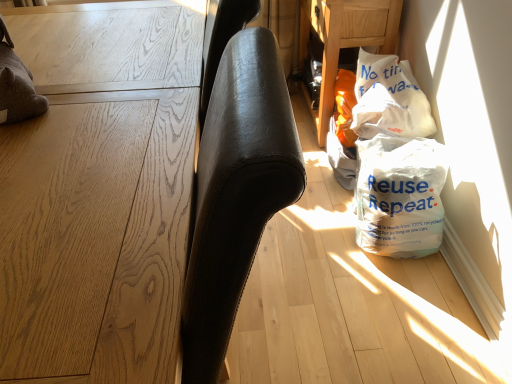
The height and width of the screenshot is (384, 512). Describe the element at coordinates (99, 193) in the screenshot. I see `light brown wood table at left` at that location.

What do you see at coordinates (400, 196) in the screenshot? Image resolution: width=512 pixels, height=384 pixels. I see `white plastic bag at lower right, positioned as the 1th grocery bag in bottom-to-top order` at bounding box center [400, 196].

Where is `white plastic bag at lower right`? The height and width of the screenshot is (384, 512). white plastic bag at lower right is located at coordinates (346, 39).

From a real-world perspective, who is located higher, white plastic bag at lower right or white plastic bag at upper right, which ranks as the 2th grocery bag in bottom-to-top order?

From a 3D spatial view, white plastic bag at upper right, which ranks as the 2th grocery bag in bottom-to-top order, is above.

Identify the location of table above the white plastic bag at upper right, which ranks as the 2th grocery bag in bottom-to-top order (from the image's perspective). (346, 39).

Would you consider white plastic bag at lower right to be distant from white plastic bag at upper right, which appears as the first grocery bag when viewed from the top?

That's not correct — white plastic bag at lower right is a little close to white plastic bag at upper right, which appears as the first grocery bag when viewed from the top.

Is white plastic bag at lower right not within white plastic bag at upper right, which ranks as the 2th grocery bag in bottom-to-top order?

Yes, white plastic bag at lower right is located beyond the bounds of white plastic bag at upper right, which ranks as the 2th grocery bag in bottom-to-top order.

Is white plastic bag at lower right, positioned as the 1th grocery bag in bottom-to-top order, wider or thinner than light brown wood table at left?

white plastic bag at lower right, positioned as the 1th grocery bag in bottom-to-top order, is thinner than light brown wood table at left.

At what (x,y) coordinates should I click in order to perform the action: click on furniture above the white plastic bag at lower right, positioned as the 1th grocery bag in bottom-to-top order (from a real-world perspective). Please return your answer as a coordinate pair (x, y). The height and width of the screenshot is (384, 512). Looking at the image, I should click on [x=99, y=193].

Is white plastic bag at lower right, positioned as the 1th grocery bag in bottom-to-top order, facing away from light brown wood table at left?

No, white plastic bag at lower right, positioned as the 1th grocery bag in bottom-to-top order, is not facing away from light brown wood table at left.

Could you tell me if white plastic bag at upper right, which appears as the first grocery bag when viewed from the top, is turned towards white plastic bag at lower right?

No, white plastic bag at upper right, which appears as the first grocery bag when viewed from the top, does not turn towards white plastic bag at lower right.

From the image's perspective, which is below, white plastic bag at upper right, which appears as the first grocery bag when viewed from the top, or white plastic bag at lower right?

white plastic bag at upper right, which appears as the first grocery bag when viewed from the top, is shown below in the image.

Is white plastic bag at upper right, which ranks as the 2th grocery bag in bottom-to-top order, located outside white plastic bag at lower right?

Yes, white plastic bag at upper right, which ranks as the 2th grocery bag in bottom-to-top order, is outside of white plastic bag at lower right.

Is white plastic bag at upper right, which ranks as the 2th grocery bag in bottom-to-top order, not close to white plastic bag at lower right?

white plastic bag at upper right, which ranks as the 2th grocery bag in bottom-to-top order, is actually quite close to white plastic bag at lower right.

From the picture: How different are the orientations of white plastic bag at lower right, positioned as the 1th grocery bag in bottom-to-top order, and white plastic bag at upper right, which ranks as the 2th grocery bag in bottom-to-top order, in degrees?

There is a 0.000392-degree angle between the facing directions of white plastic bag at lower right, positioned as the 1th grocery bag in bottom-to-top order, and white plastic bag at upper right, which ranks as the 2th grocery bag in bottom-to-top order.

Which of these two, white plastic bag at lower right, positioned as the 1th grocery bag in bottom-to-top order, or white plastic bag at upper right, which ranks as the 2th grocery bag in bottom-to-top order, is wider?

With larger width is white plastic bag at lower right, positioned as the 1th grocery bag in bottom-to-top order.

Which is more to the right, white plastic bag at lower right, the second grocery bag positioned from the top, or white plastic bag at upper right, which ranks as the 2th grocery bag in bottom-to-top order?

white plastic bag at lower right, the second grocery bag positioned from the top.

Between light brown wood table at left and white plastic bag at lower right, which one has less height?

white plastic bag at lower right.

Which object is closer to the camera taking this photo, light brown wood table at left or white plastic bag at lower right?

light brown wood table at left is in front.

Is light brown wood table at left not inside white plastic bag at lower right?

light brown wood table at left is positioned outside white plastic bag at lower right.

Based on the photo, between light brown wood table at left and white plastic bag at lower right, which one appears on the left side from the viewer's perspective?

light brown wood table at left.

From a real-world perspective, which is physically above, light brown wood table at left or white plastic bag at lower right, the second grocery bag positioned from the top?

In real-world perspective, light brown wood table at left is above.

Considering the sizes of objects light brown wood table at left and white plastic bag at lower right, positioned as the 1th grocery bag in bottom-to-top order, in the image provided, who is shorter, light brown wood table at left or white plastic bag at lower right, positioned as the 1th grocery bag in bottom-to-top order,?

With less height is white plastic bag at lower right, positioned as the 1th grocery bag in bottom-to-top order.

Based on the photo, considering the relative positions of light brown wood table at left and white plastic bag at lower right, positioned as the 1th grocery bag in bottom-to-top order, in the image provided, is light brown wood table at left to the left of white plastic bag at lower right, positioned as the 1th grocery bag in bottom-to-top order, from the viewer's perspective?

Indeed, light brown wood table at left is positioned on the left side of white plastic bag at lower right, positioned as the 1th grocery bag in bottom-to-top order.

Which object is further away from the camera, light brown wood table at left or white plastic bag at upper right, which ranks as the 2th grocery bag in bottom-to-top order?

white plastic bag at upper right, which ranks as the 2th grocery bag in bottom-to-top order.

Is light brown wood table at left shorter than white plastic bag at upper right, which ranks as the 2th grocery bag in bottom-to-top order?

No.

Looking at this image, from a real-world perspective, which is physically below, light brown wood table at left or white plastic bag at upper right, which appears as the first grocery bag when viewed from the top?

light brown wood table at left.

From the image's perspective, which object appears higher, light brown wood table at left or white plastic bag at upper right, which appears as the first grocery bag when viewed from the top?

white plastic bag at upper right, which appears as the first grocery bag when viewed from the top, appears higher in the image.

Identify the location of the 1st grocery bag in front of the white plastic bag at lower right. This screenshot has width=512, height=384. (389, 99).

In the image, there is a light brown wood table at left. Where is `grocery bag below it (from a real-world perspective)`? Image resolution: width=512 pixels, height=384 pixels. grocery bag below it (from a real-world perspective) is located at coordinates (400, 196).

Considering their positions, is white plastic bag at lower right, the second grocery bag positioned from the top, positioned closer to white plastic bag at lower right than light brown wood table at left?

white plastic bag at lower right, the second grocery bag positioned from the top, is positioned closer to the anchor white plastic bag at lower right.

When comparing their distances from light brown wood table at left, does white plastic bag at lower right, positioned as the 1th grocery bag in bottom-to-top order, or white plastic bag at lower right seem further?

white plastic bag at lower right is positioned further to the anchor light brown wood table at left.

From the image, which object appears to be farther from white plastic bag at lower right, white plastic bag at upper right, which ranks as the 2th grocery bag in bottom-to-top order, or light brown wood table at left?

light brown wood table at left lies further to white plastic bag at lower right than the other object.

Based on their spatial positions, is light brown wood table at left or white plastic bag at lower right, positioned as the 1th grocery bag in bottom-to-top order, closer to white plastic bag at lower right?

white plastic bag at lower right, positioned as the 1th grocery bag in bottom-to-top order, is positioned closer to the anchor white plastic bag at lower right.

From the image, which object appears to be nearer to white plastic bag at lower right, the second grocery bag positioned from the top, white plastic bag at lower right or light brown wood table at left?

Among the two, white plastic bag at lower right is located nearer to white plastic bag at lower right, the second grocery bag positioned from the top.

Looking at the image, which one is located further to white plastic bag at lower right, white plastic bag at upper right, which ranks as the 2th grocery bag in bottom-to-top order, or white plastic bag at lower right, the second grocery bag positioned from the top?

Among the two, white plastic bag at lower right, the second grocery bag positioned from the top, is located further to white plastic bag at lower right.

From the image, which object appears to be farther from light brown wood table at left, white plastic bag at upper right, which appears as the first grocery bag when viewed from the top, or white plastic bag at lower right?

white plastic bag at lower right.

From the picture: Estimate the real-world distances between objects in this image. Which object is further from light brown wood table at left, white plastic bag at lower right, positioned as the 1th grocery bag in bottom-to-top order, or white plastic bag at upper right, which ranks as the 2th grocery bag in bottom-to-top order?

white plastic bag at upper right, which ranks as the 2th grocery bag in bottom-to-top order, is positioned further to the anchor light brown wood table at left.

You are a GUI agent. You are given a task and a screenshot of the screen. Output one action in this format:
    pyautogui.click(x=<x>, y=<y>)
    Task: Click on the grocery bag between white plastic bag at lower right and white plastic bag at lower right, the second grocery bag positioned from the top, vertically
    This screenshot has width=512, height=384.
    Given the screenshot: What is the action you would take?
    pyautogui.click(x=389, y=99)

This screenshot has width=512, height=384. I want to click on grocery bag situated between light brown wood table at left and white plastic bag at lower right, positioned as the 1th grocery bag in bottom-to-top order, from left to right, so click(389, 99).